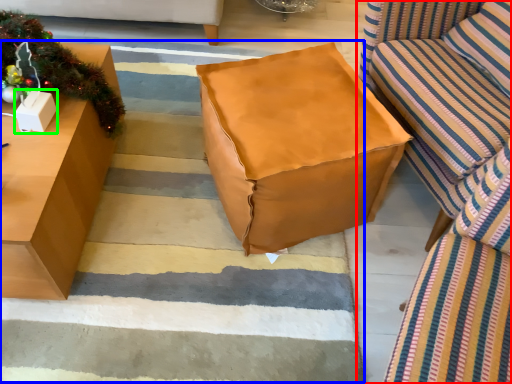
Question: Which object is the farthest from studio couch (highlighted by a red box)? Choose among these: stair (highlighted by a blue box) or cardboard box (highlighted by a green box).

Choices:
 (A) stair
 (B) cardboard box

Answer: (B)